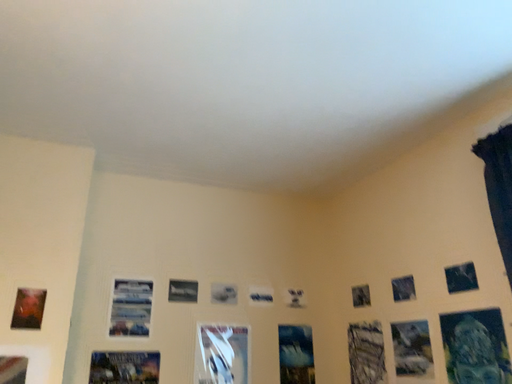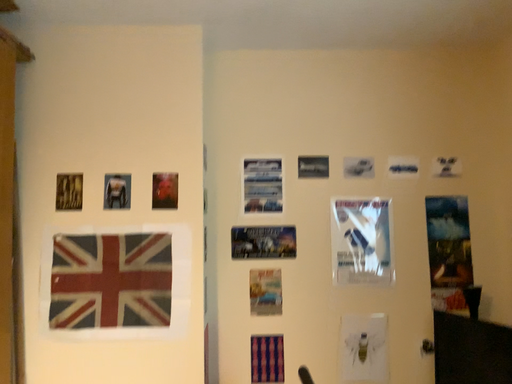
Question: Which way did the camera rotate in the video?

Choices:
 (A) rotated upward
 (B) rotated downward

Answer: (B)